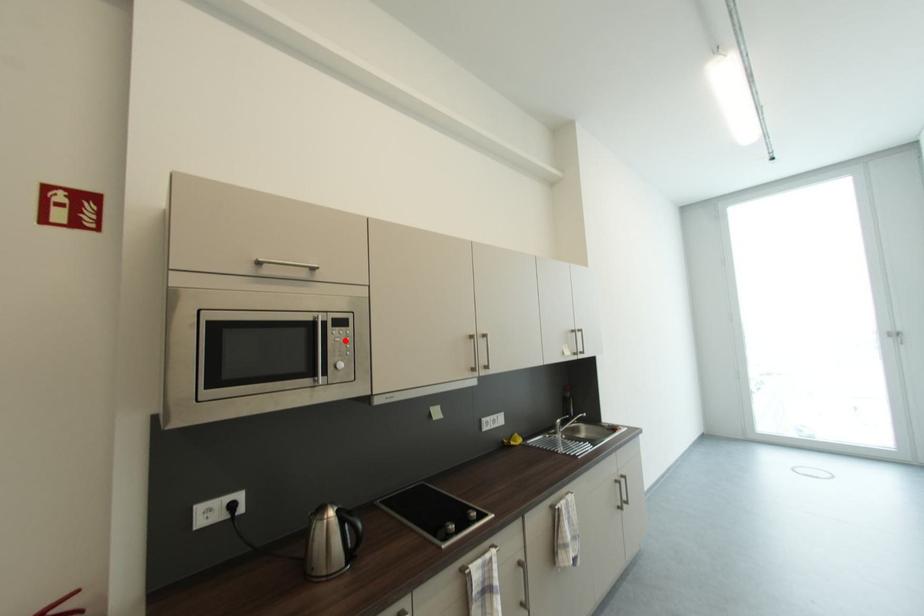
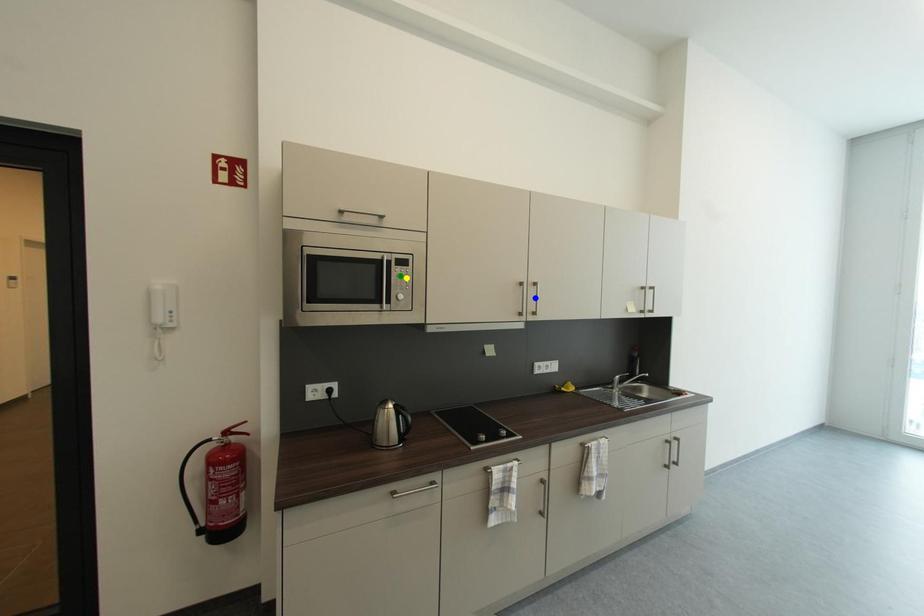
Question: I am providing you with two images of the same scene from different viewpoints. A red point is marked on the first image. You are given multiple points on the second image. Which point in image 2 represents the same 3d spot as the red point in image 1?

Choices:
 (A) green point
 (B) yellow point
 (C) blue point

Answer: (B)